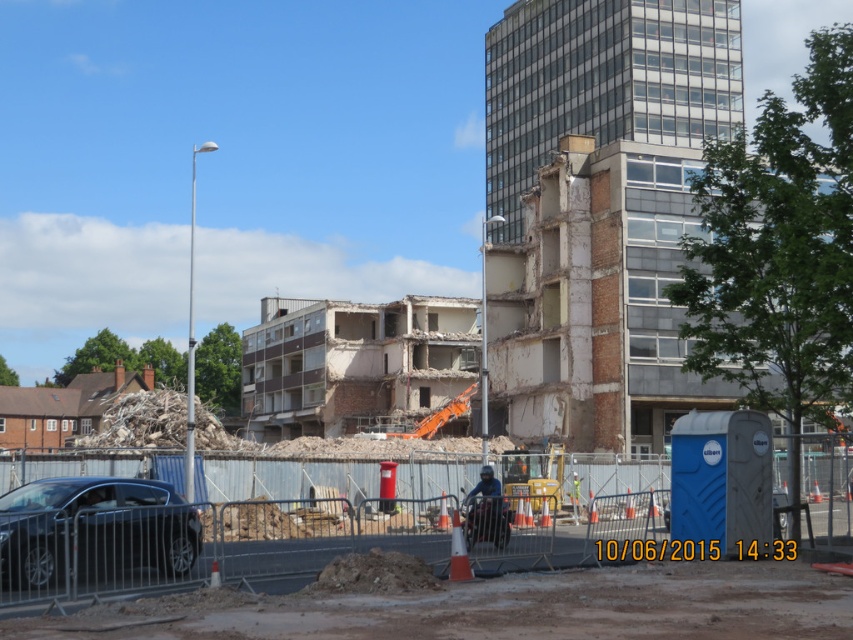
Between shiny black sedan at lower left and blue plastic website at center, which one is positioned higher?

shiny black sedan at lower left is above.

Which is more to the right, shiny black sedan at lower left or blue plastic website at center?

blue plastic website at center is more to the right.

The width and height of the screenshot is (853, 640). In order to click on shiny black sedan at lower left in this screenshot , I will do `click(94, 532)`.

The height and width of the screenshot is (640, 853). Find the location of `shiny black sedan at lower left`. shiny black sedan at lower left is located at coordinates (94, 532).

Is point (164, 627) closer to camera compared to point (498, 524)?

Yes, point (164, 627) is closer to viewer.

In the scene shown: How much distance is there between concrete barrier at center and blue fabric construction worker at center?

They are 4.08 meters apart.

Who is more forward, (358,570) or (485,465)?

Point (358,570) is in front.

The width and height of the screenshot is (853, 640). I want to click on concrete barrier at center, so click(x=485, y=605).

Which is more to the left, concrete barrier at center or blue plastic website at center?

From the viewer's perspective, concrete barrier at center appears more on the left side.

In order to click on concrete barrier at center in this screenshot , I will do `click(485, 605)`.